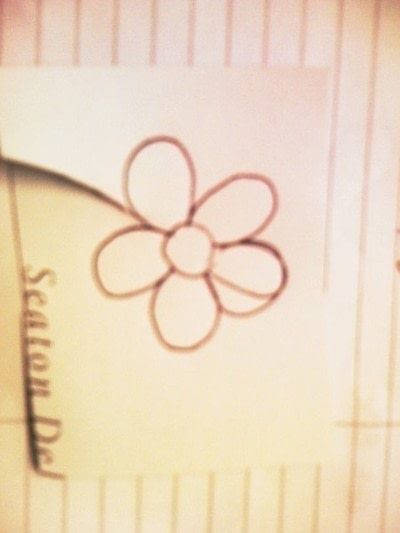
Identify the location of note paper below drawing. Image resolution: width=400 pixels, height=533 pixels. (195, 508).